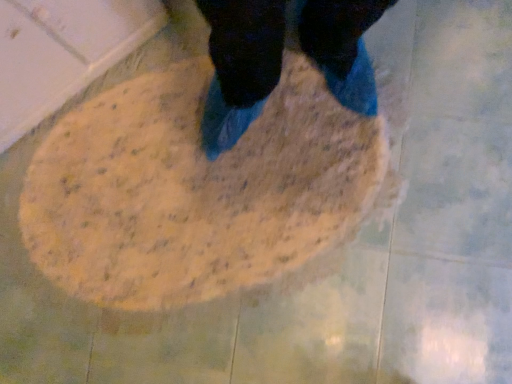
What do you see at coordinates (194, 189) in the screenshot?
I see `beige textured rug at center` at bounding box center [194, 189].

Locate an element on the screen. This screenshot has width=512, height=384. beige textured rug at center is located at coordinates (194, 189).

Image resolution: width=512 pixels, height=384 pixels. Identify the location of beige textured rug at center. (194, 189).